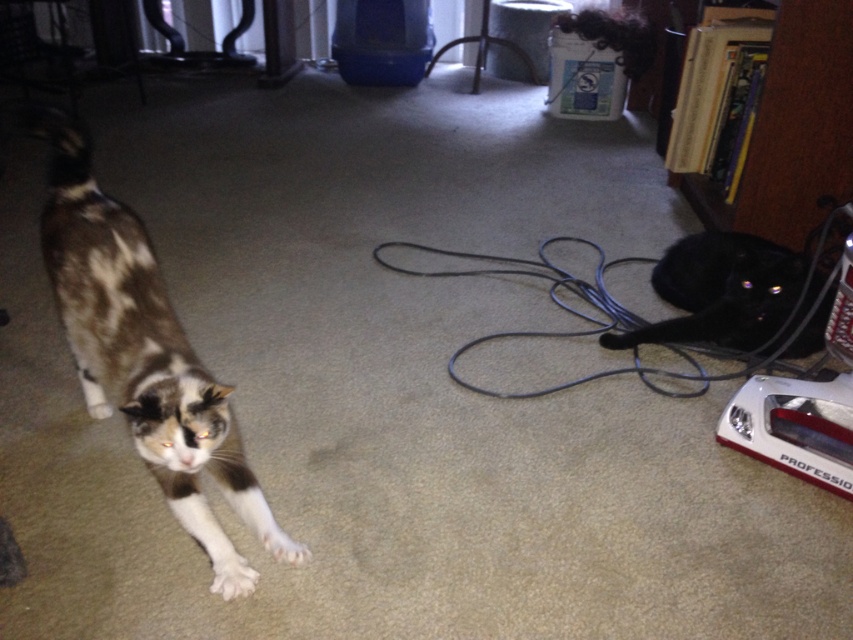
Question: Which of the following is the closest to the observer?

Choices:
 (A) white soft fur paw at lower left
 (B) black glossy cat at lower right
 (C) white soft paw at lower left
 (D) calico fur cat at left

Answer: (D)

Question: Which of the following is the closest to the observer?

Choices:
 (A) white soft paw at lower left
 (B) white soft fur paw at lower left
 (C) black rubber cord at lower right
 (D) black glossy cat at lower right

Answer: (A)

Question: Among these objects, which one is nearest to the camera?

Choices:
 (A) black rubber cord at lower right
 (B) white soft fur paw at lower left
 (C) black glossy cat at lower right
 (D) calico fur cat at left

Answer: (D)

Question: Is the position of black glossy cat at lower right more distant than that of white soft paw at lower left?

Choices:
 (A) no
 (B) yes

Answer: (B)

Question: Does black rubber cord at lower right have a lesser width compared to white soft fur paw at lower left?

Choices:
 (A) no
 (B) yes

Answer: (A)

Question: Is the position of black rubber cord at lower right more distant than that of white soft fur paw at lower left?

Choices:
 (A) no
 (B) yes

Answer: (B)